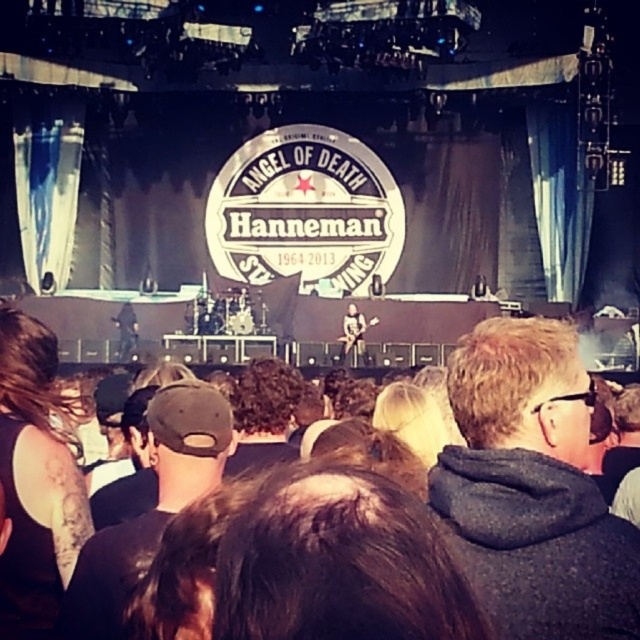
Which is behind, point (634, 560) or point (51, 449)?

Positioned behind is point (51, 449).

Can you confirm if dark gray hoodie at center is positioned below dark brown hair at lower left?

Incorrect, dark gray hoodie at center is not positioned below dark brown hair at lower left.

You are a GUI agent. You are given a task and a screenshot of the screen. Output one action in this format:
    pyautogui.click(x=<x>, y=<y>)
    Task: Click on the dark gray hoodie at center
    The image size is (640, 640).
    Given the screenshot: What is the action you would take?
    pyautogui.click(x=531, y=488)

At what (x,y) coordinates should I click in order to perform the action: click on dark gray hoodie at center. Please return your answer as a coordinate pair (x, y). This screenshot has height=640, width=640. Looking at the image, I should click on (531, 488).

Can you confirm if dark gray hoodie at center is taller than black fabric cap at center?

Yes, dark gray hoodie at center is taller than black fabric cap at center.

Between dark gray hoodie at center and black fabric cap at center, which one is positioned higher?

dark gray hoodie at center is above.

Image resolution: width=640 pixels, height=640 pixels. Find the location of `dark gray hoodie at center`. dark gray hoodie at center is located at coordinates (531, 488).

Which is above, dark brown hair at lower left or black fabric cap at center?

Positioned higher is dark brown hair at lower left.

Between dark brown hair at lower left and black fabric cap at center, which one has more height?

With more height is dark brown hair at lower left.

Where is `dark brown hair at lower left`? dark brown hair at lower left is located at coordinates (35, 481).

Locate an element on the screen. The image size is (640, 640). dark brown hair at lower left is located at coordinates (35, 481).